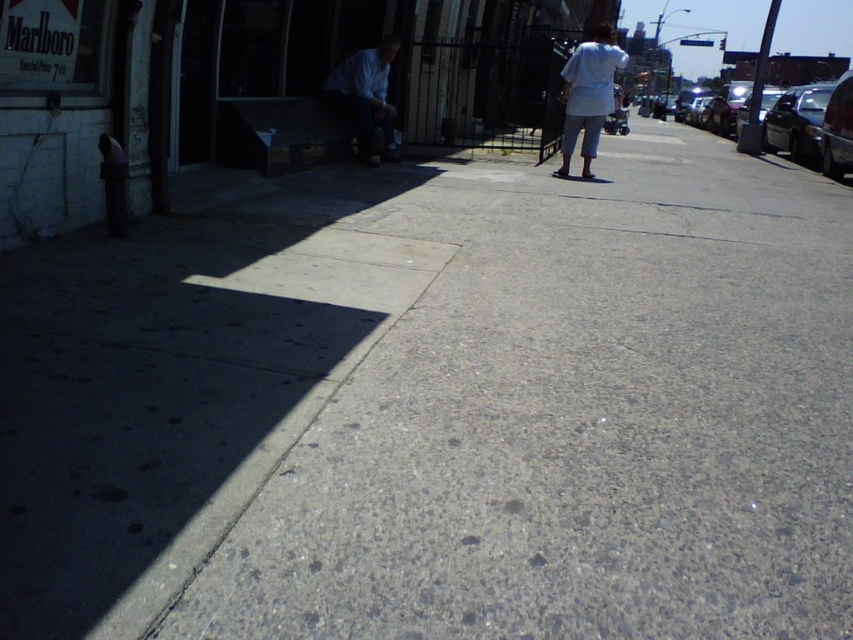
Question: Can you confirm if matte blue shirt at upper left is thinner than shiny black sedan at right?

Choices:
 (A) yes
 (B) no

Answer: (A)

Question: Does matte blue shirt at upper left appear on the left side of shiny black sedan at right?

Choices:
 (A) yes
 (B) no

Answer: (A)

Question: Which object is closer to the camera taking this photo?

Choices:
 (A) shiny black sedan at right
 (B) metallic silver van at right
 (C) matte blue shirt at upper left
 (D) white cotton pants at center

Answer: (D)

Question: Can you confirm if matte blue shirt at upper left is wider than shiny black sedan at right?

Choices:
 (A) yes
 (B) no

Answer: (B)

Question: Which of the following is the farthest from the observer?

Choices:
 (A) (351, 97)
 (B) (839, 128)
 (C) (781, 147)
 (D) (583, 104)

Answer: (C)

Question: Which of the following is the farthest from the observer?

Choices:
 (A) metallic silver van at right
 (B) shiny black sedan at right
 (C) white cotton pants at center
 (D) matte blue shirt at upper left

Answer: (B)